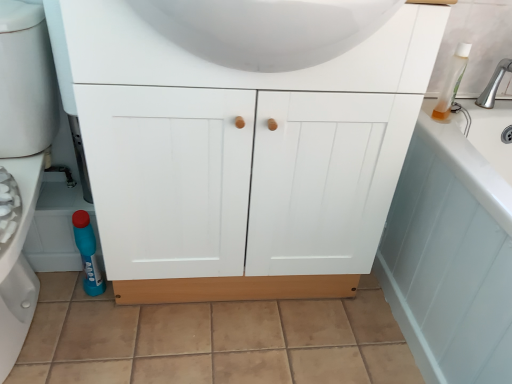
I want to click on vacant area that is in front of blue plastic bottle at lower left, so click(x=77, y=324).